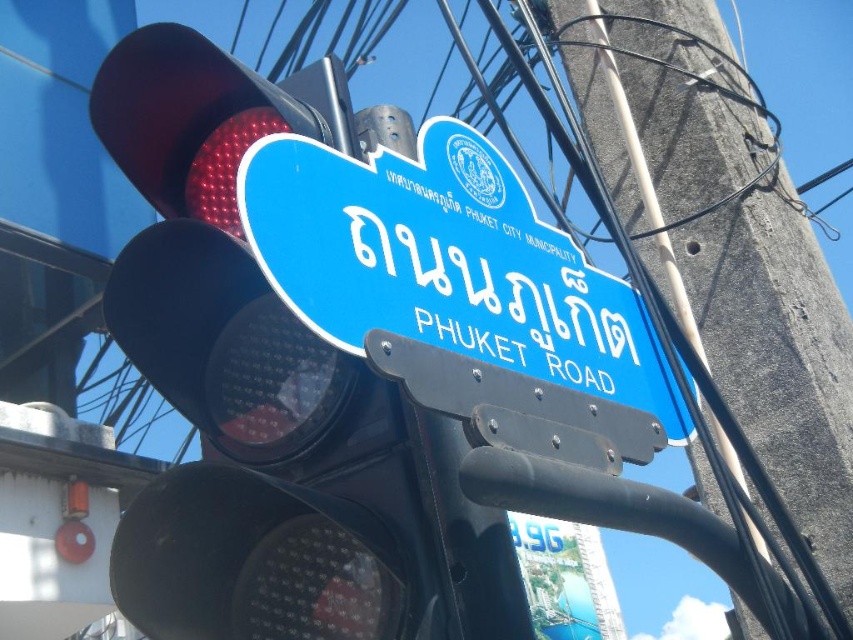
Question: Is metallic traffic light at upper left bigger than gray concrete telegraph pole at upper center?

Choices:
 (A) no
 (B) yes

Answer: (A)

Question: Can you confirm if gray concrete telegraph pole at upper center is positioned to the left of blue plastic street sign at upper center?

Choices:
 (A) yes
 (B) no

Answer: (B)

Question: Which point is farther from the camera taking this photo?

Choices:
 (A) (360, 413)
 (B) (587, 376)

Answer: (B)

Question: Which object is positioned farthest from the blue plastic street sign at upper center?

Choices:
 (A) gray concrete telegraph pole at upper center
 (B) metallic traffic light at upper left

Answer: (A)

Question: Which is nearer to the metallic traffic light at upper left?

Choices:
 (A) blue plastic street sign at upper center
 (B) gray concrete telegraph pole at upper center

Answer: (A)

Question: Is metallic traffic light at upper left in front of gray concrete telegraph pole at upper center?

Choices:
 (A) yes
 (B) no

Answer: (A)